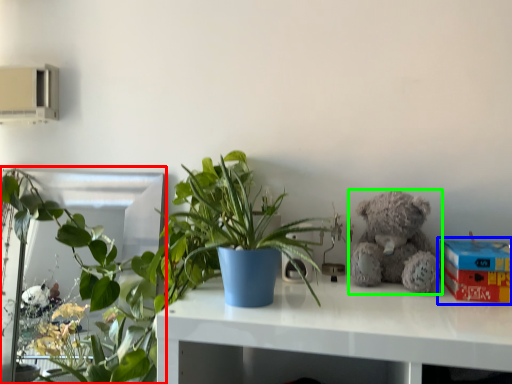
Question: Based on their relative distances, which object is nearer to houseplant (highlighted by a red box)? Choose from box (highlighted by a blue box) and teddy bear (highlighted by a green box).

Choices:
 (A) box
 (B) teddy bear

Answer: (B)